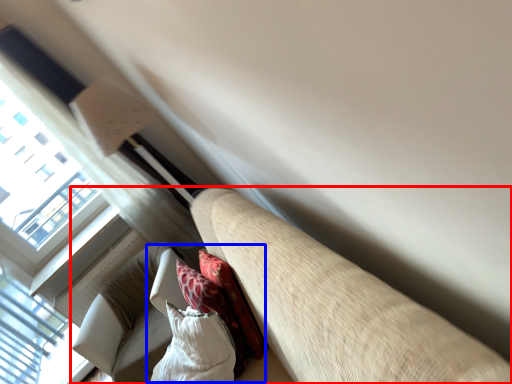
Question: Which of the following is the closest to the observer, studio couch (highlighted by a red box) or bean bag chair (highlighted by a blue box)?

Choices:
 (A) studio couch
 (B) bean bag chair

Answer: (A)